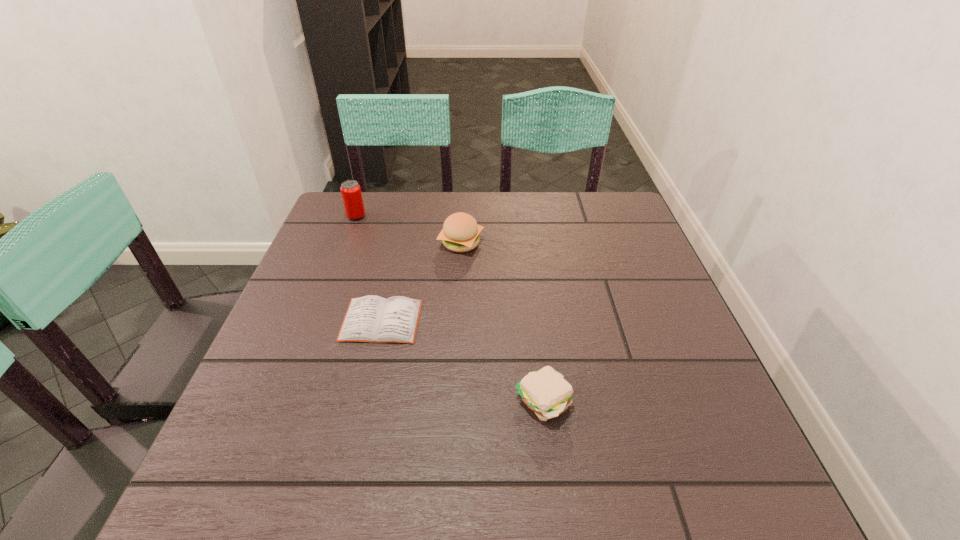
The image size is (960, 540). I want to click on the leftmost object, so click(x=351, y=193).

The height and width of the screenshot is (540, 960). I want to click on the farthest object, so click(x=351, y=193).

Where is `the second farthest object`? The image size is (960, 540). the second farthest object is located at coordinates (460, 233).

Find the location of `the third object from left to right`. the third object from left to right is located at coordinates (460, 233).

In order to click on the second shortest object in this screenshot , I will do click(546, 392).

Image resolution: width=960 pixels, height=540 pixels. I want to click on the nearest object, so click(546, 392).

In order to click on the third farthest object in this screenshot , I will do `click(373, 319)`.

Where is `the third object from right to left`? This screenshot has width=960, height=540. the third object from right to left is located at coordinates (373, 319).

This screenshot has height=540, width=960. What are the coordinates of `vacant space located on the right of the leftmost object` in the screenshot? It's located at (394, 217).

Identify the location of blank space located on the left of the second farthest object. This screenshot has width=960, height=540. (389, 243).